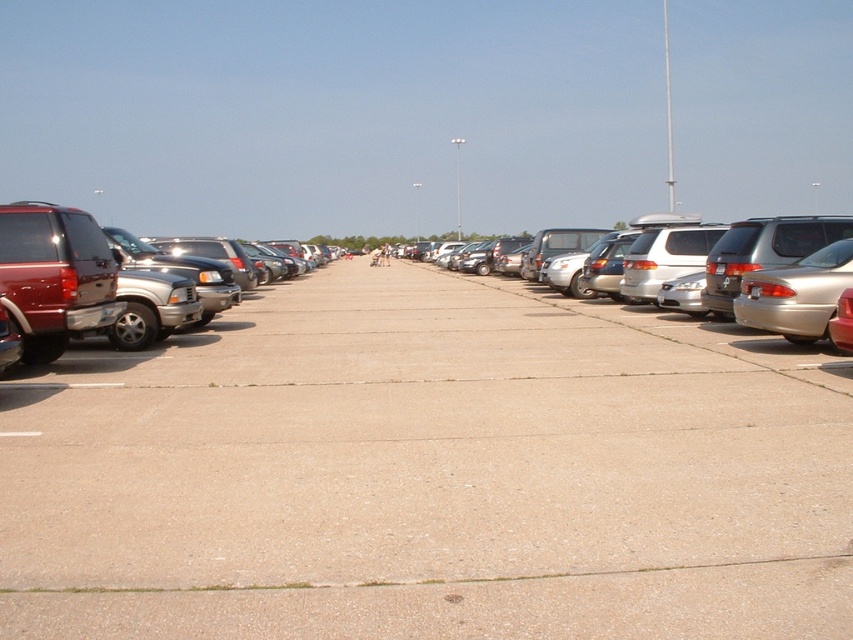
Question: Is gray concrete pavement at center to the left of metallic silver sedan at right from the viewer's perspective?

Choices:
 (A) yes
 (B) no

Answer: (A)

Question: Estimate the real-world distances between objects in this image. Which object is closer to the gray concrete pavement at center?

Choices:
 (A) shiny metallic suv at left
 (B) silver metallic minivan at right

Answer: (B)

Question: Which is farther from the gray concrete pavement at center?

Choices:
 (A) shiny metallic suv at left
 (B) silver metallic minivan at right

Answer: (A)

Question: Which object is the closest to the gray concrete pavement at center?

Choices:
 (A) metallic silver sedan at right
 (B) shiny metallic suv at left
 (C) silver metallic minivan at right

Answer: (A)

Question: Considering the relative positions of gray concrete pavement at center and metallic silver sedan at right in the image provided, where is gray concrete pavement at center located with respect to metallic silver sedan at right?

Choices:
 (A) below
 (B) above

Answer: (A)

Question: Does gray concrete pavement at center have a lesser width compared to metallic silver sedan at right?

Choices:
 (A) yes
 (B) no

Answer: (B)